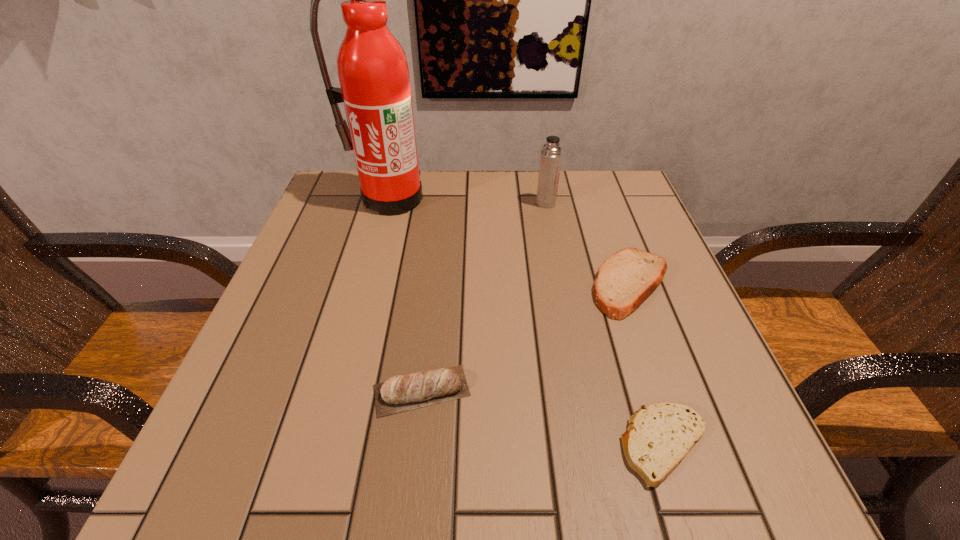
Locate an element on the screen. This screenshot has width=960, height=540. free point that satisfies the following two spatial constraints: 1. on the back side of the third farthest object; 2. on the left side of the leftmost pita bread is located at coordinates tap(434, 285).

At what (x,y) coordinates should I click in order to perform the action: click on vacant space that satisfies the following two spatial constraints: 1. on the back side of the third nearest object; 2. on the left side of the shortest object. Please return your answer as a coordinate pair (x, y). Looking at the image, I should click on (613, 285).

Identify the location of free space that satisfies the following two spatial constraints: 1. on the label side of the leftmost pita bread; 2. on the right side of the fire extinguisher. (338, 390).